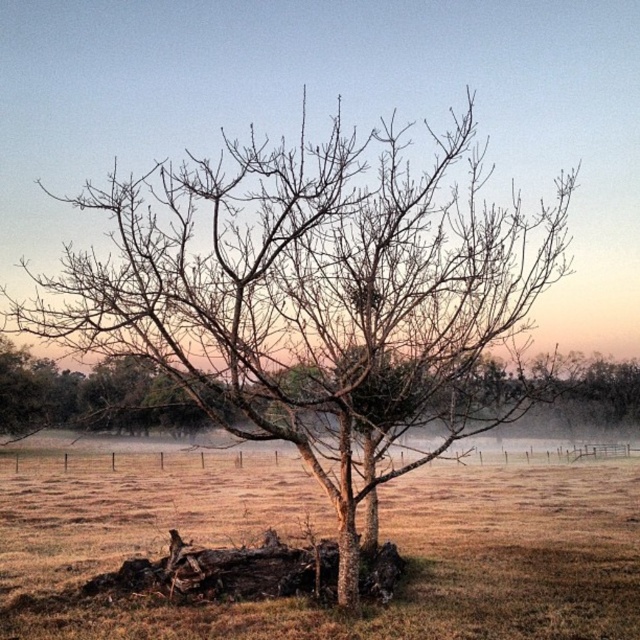
Question: Is brown grass at center to the left of bare wood tree at center from the viewer's perspective?

Choices:
 (A) yes
 (B) no

Answer: (A)

Question: Which of the following is the farthest from the observer?

Choices:
 (A) (595, 385)
 (B) (625, 480)

Answer: (A)

Question: Can you confirm if brown grass at center is smaller than bare wood tree at center?

Choices:
 (A) no
 (B) yes

Answer: (B)

Question: Is brown grass at center above bare wood tree at center?

Choices:
 (A) yes
 (B) no

Answer: (B)